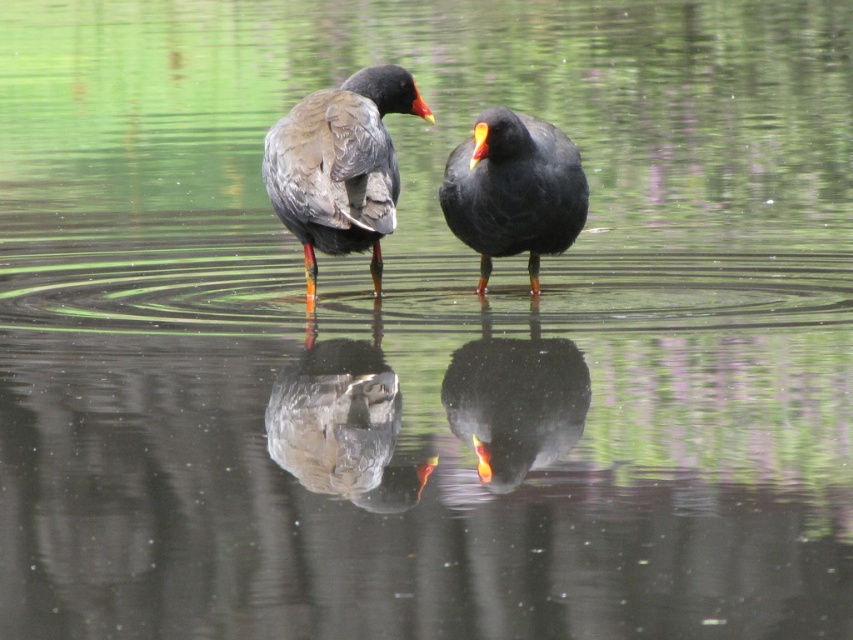
Where is the matte black duck at center located in the image?

The matte black duck at center is located at point (514, 189).

You are a wildlife photographer aiming to capture a closeup shot of both birds without disturbing them. Given that your camera has a maximum effective range of 30 inches, can you get a clear shot of both the matte gray bird at center and the dark gray matte bird at center from your current position?

The distance between the matte gray bird at center and the dark gray matte bird at center is 38.08 inches, which exceeds your camera maximum effective range of 30 inches. Therefore, you cannot capture both birds clearly in a single shot without moving closer.